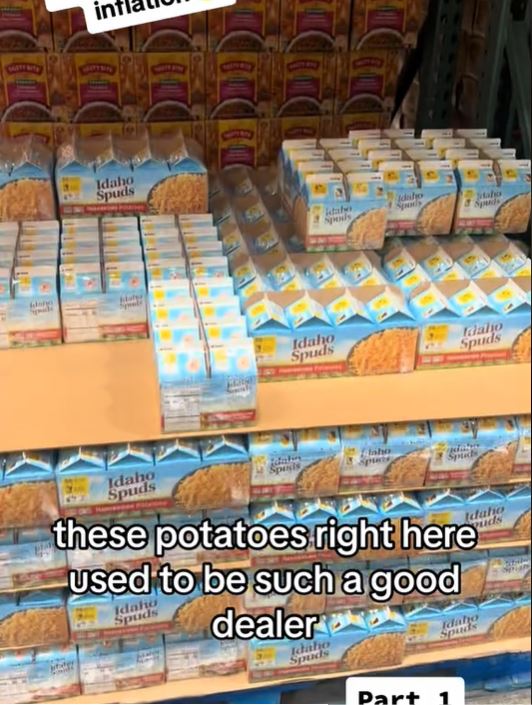
The width and height of the screenshot is (532, 705). Identify the location of area under middle shelf. (239, 436).